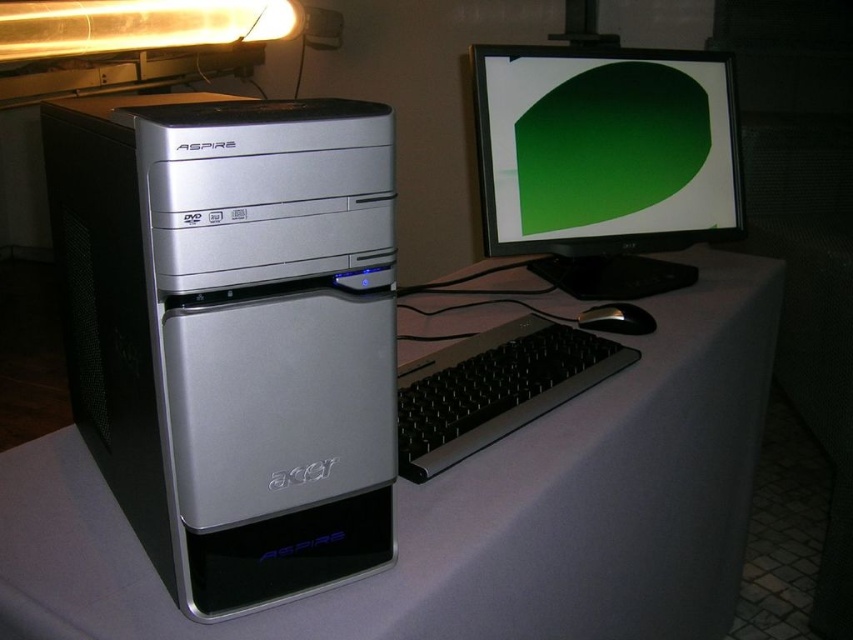
Between matte black monitor at upper right and black plastic mouse at lower right, which one is positioned higher?

matte black monitor at upper right is above.

Between point (718, 93) and point (616, 312), which one is positioned in front?

Point (616, 312) is more forward.

I want to click on matte black monitor at upper right, so click(x=605, y=161).

In the scene shown: Is silver metallic computer tower at left above black plastic mouse at lower right?

Correct, silver metallic computer tower at left is located above black plastic mouse at lower right.

Can you confirm if silver metallic computer tower at left is wider than black plastic mouse at lower right?

Correct, the width of silver metallic computer tower at left exceeds that of black plastic mouse at lower right.

Is point (103, 140) positioned in front of point (587, 317)?

Yes, it is.

The height and width of the screenshot is (640, 853). Identify the location of silver metallic computer tower at left. (231, 332).

Describe the element at coordinates (477, 509) in the screenshot. The width and height of the screenshot is (853, 640). I see `white matte computer desk at center` at that location.

Which is in front, point (16, 586) or point (625, 326)?

Positioned in front is point (16, 586).

The height and width of the screenshot is (640, 853). Identify the location of white matte computer desk at center. (477, 509).